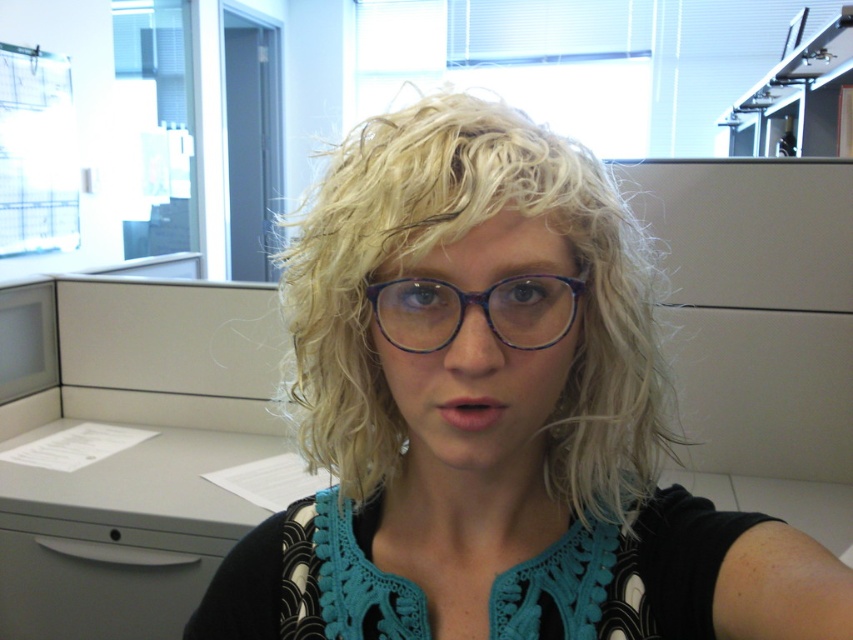
Question: Can you confirm if gray plastic file cabinet at left is thinner than purple acetate glasses at center?

Choices:
 (A) no
 (B) yes

Answer: (A)

Question: Among these points, which one is farthest from the camera?

Choices:
 (A) (556, 296)
 (B) (233, 289)

Answer: (B)

Question: Does gray plastic file cabinet at left come behind purple acetate glasses at center?

Choices:
 (A) no
 (B) yes

Answer: (B)

Question: Is gray plastic file cabinet at left closer to camera compared to purple acetate glasses at center?

Choices:
 (A) no
 (B) yes

Answer: (A)

Question: Among these points, which one is farthest from the camera?

Choices:
 (A) (354, 408)
 (B) (165, 477)

Answer: (B)

Question: Which of the following is the closest to the observer?

Choices:
 (A) purple acetate glasses at center
 (B) blonde hair at center

Answer: (B)